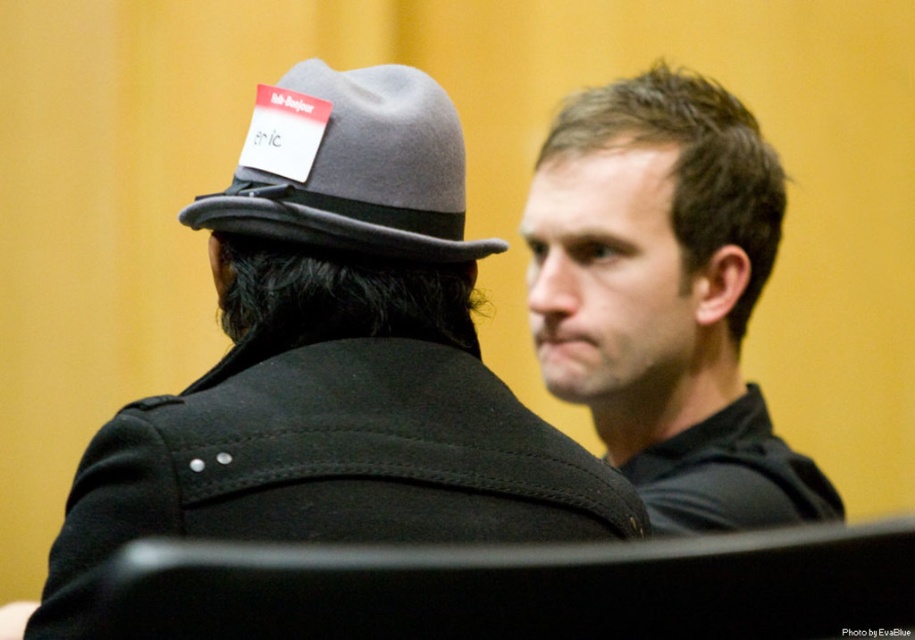
Question: Does matte gray hat at upper left have a lesser width compared to brown matte hair at upper right?

Choices:
 (A) no
 (B) yes

Answer: (A)

Question: Is matte gray hat at upper left below brown matte hair at upper right?

Choices:
 (A) no
 (B) yes

Answer: (B)

Question: Which is farther from the brown matte hair at upper right?

Choices:
 (A) matte gray hat at upper left
 (B) gray felt fedora at upper left

Answer: (B)

Question: From the image, what is the correct spatial relationship of matte gray hat at upper left in relation to brown matte hair at upper right?

Choices:
 (A) above
 (B) below

Answer: (B)

Question: Based on their relative distances, which object is farther from the matte gray hat at upper left?

Choices:
 (A) brown matte hair at upper right
 (B) gray felt fedora at upper left

Answer: (A)

Question: Considering the real-world distances, which object is farthest from the matte gray hat at upper left?

Choices:
 (A) brown matte hair at upper right
 (B) gray felt fedora at upper left

Answer: (A)